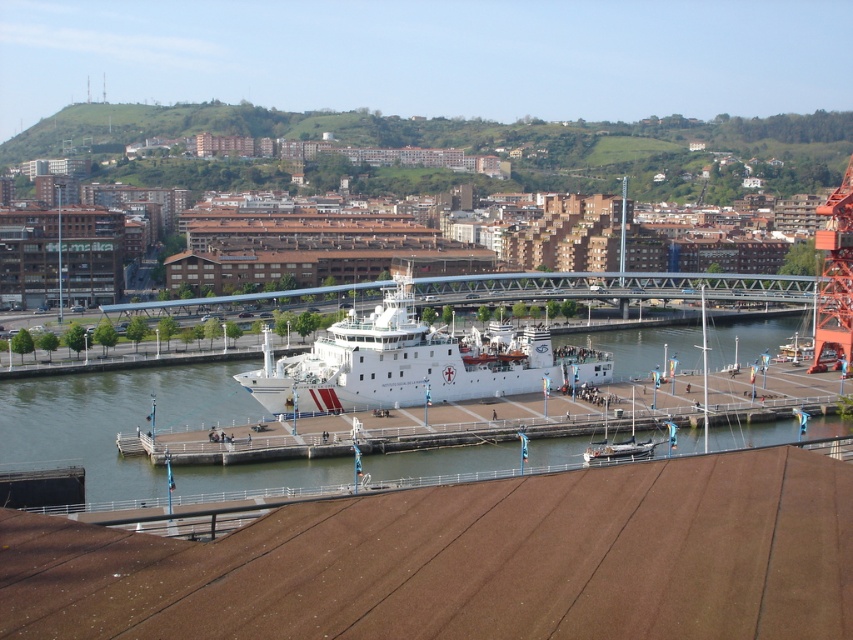
Is brown wooden dock at lower center taller than metallic gray bridge at center?

Incorrect, brown wooden dock at lower center's height is not larger of metallic gray bridge at center's.

Who is more distant from viewer, (6, 611) or (252, 300)?

Positioned behind is point (252, 300).

This screenshot has width=853, height=640. Identify the location of brown wooden dock at lower center. (471, 561).

Is brown wooden dock at lower center positioned behind white matte ship at center?

No, it is in front of white matte ship at center.

What do you see at coordinates (471, 561) in the screenshot? I see `brown wooden dock at lower center` at bounding box center [471, 561].

This screenshot has width=853, height=640. What do you see at coordinates (471, 561) in the screenshot?
I see `brown wooden dock at lower center` at bounding box center [471, 561].

Identify the location of brown wooden dock at lower center. point(471,561).

Can you confirm if clear water at center is positioned to the left of wooden sailboat at center?

Yes, clear water at center is to the left of wooden sailboat at center.

Is point (408, 468) farther from viewer compared to point (589, 452)?

Yes.

Identify the location of clear water at center. This screenshot has height=640, width=853. (115, 420).

Identify the location of clear water at center. (115, 420).